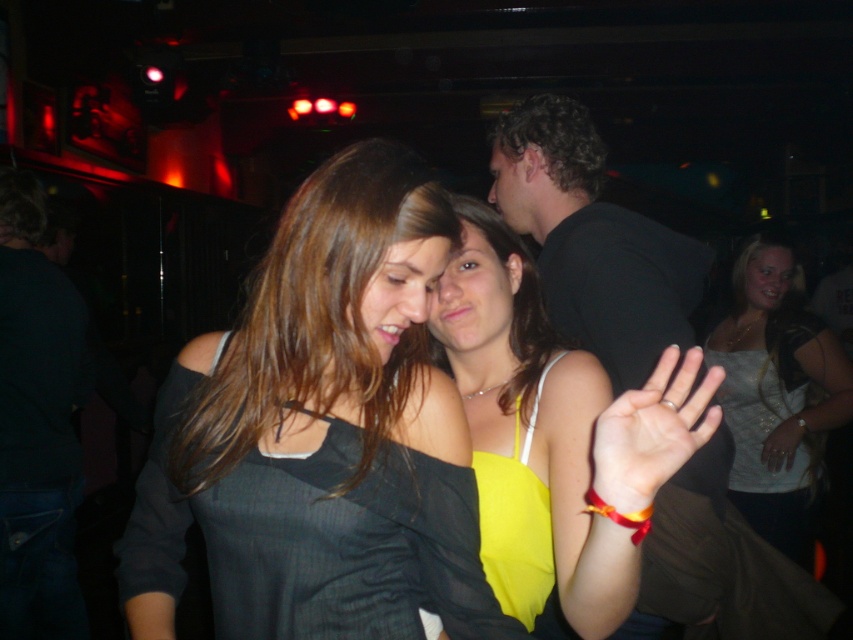
Can you confirm if shiny silver tank top at center is positioned below curly hair at upper right?

Correct, shiny silver tank top at center is located below curly hair at upper right.

Does shiny silver tank top at center have a greater width compared to curly hair at upper right?

Indeed, shiny silver tank top at center has a greater width compared to curly hair at upper right.

Is point (740, 506) farther from viewer compared to point (583, 141)?

That is True.

Locate an element on the screen. The width and height of the screenshot is (853, 640). shiny silver tank top at center is located at coordinates (776, 390).

Who is shorter, matte black dress at center or smooth yellow fabric at center?

smooth yellow fabric at center is shorter.

Does matte black dress at center appear on the right side of smooth yellow fabric at center?

Incorrect, matte black dress at center is not on the right side of smooth yellow fabric at center.

Who is more forward, (386, 170) or (682, 449)?

Point (682, 449) is in front.

Where is `matte black dress at center`? Image resolution: width=853 pixels, height=640 pixels. matte black dress at center is located at coordinates (323, 432).

Does yellow satin tank top at center have a lesser width compared to black matte shirt at upper right?

Indeed, yellow satin tank top at center has a lesser width compared to black matte shirt at upper right.

Between point (538, 609) and point (689, 289), which one is positioned in front?

Point (538, 609)

Does point (457, 204) lie behind point (575, 218)?

No, (457, 204) is closer to viewer.

The image size is (853, 640). What are the coordinates of `yellow satin tank top at center` in the screenshot? It's located at (529, 433).